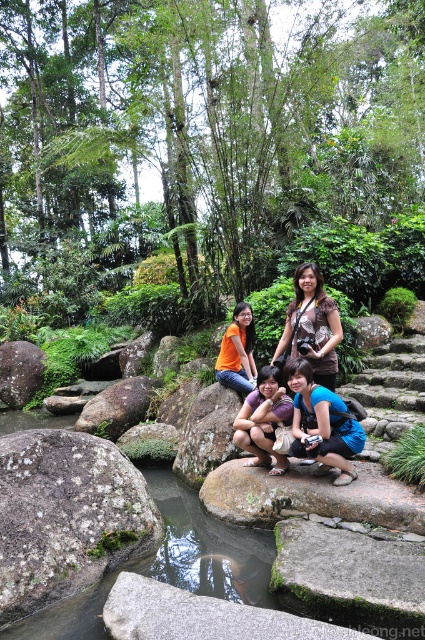
Question: Is gray rough stone at center smaller than orange cotton shirt at center?

Choices:
 (A) no
 (B) yes

Answer: (B)

Question: Which point appears closest to the camera in this image?

Choices:
 (A) (192, 621)
 (B) (30, 342)
 (C) (269, 387)

Answer: (A)

Question: Which object is positioned closest to the gray rough rock at center?

Choices:
 (A) matte brown shirt at center
 (B) purple fabric shirt at center
 (C) speckled gray rock at left
 (D) green mossy rock at center

Answer: (B)

Question: Which point appears farthest from the camera in this image?

Choices:
 (A) (184, 432)
 (B) (65, 476)
 (C) (292, 346)
 (D) (363, 614)

Answer: (A)

Question: Is the position of green mossy stone at center less distant than that of matte brown shirt at center?

Choices:
 (A) yes
 (B) no

Answer: (A)

Question: Can you confirm if green mossy rock at center is smaller than brown rough rock at center?

Choices:
 (A) yes
 (B) no

Answer: (B)